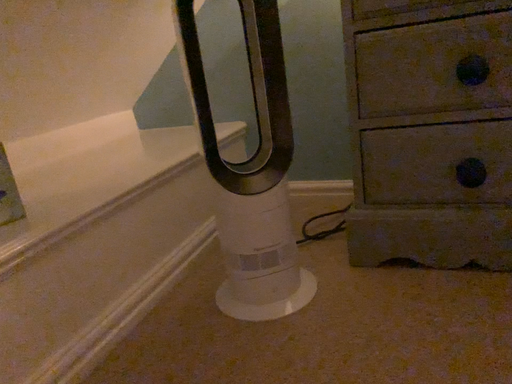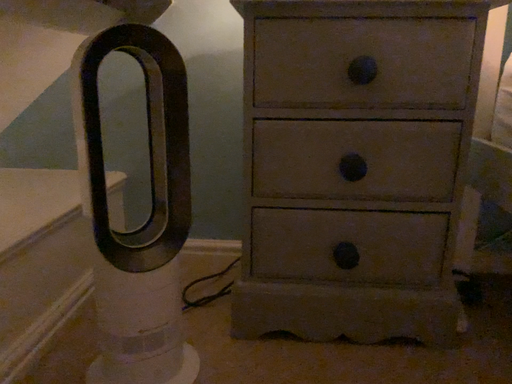
Question: Which way did the camera rotate in the video?

Choices:
 (A) rotated right
 (B) rotated left

Answer: (A)